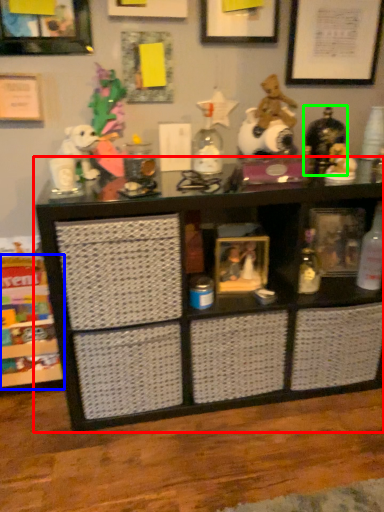
Question: Which object is positioned farthest from shelf (highlighted by a red box)? Select from shelf (highlighted by a blue box) and toy (highlighted by a green box).

Choices:
 (A) shelf
 (B) toy

Answer: (B)